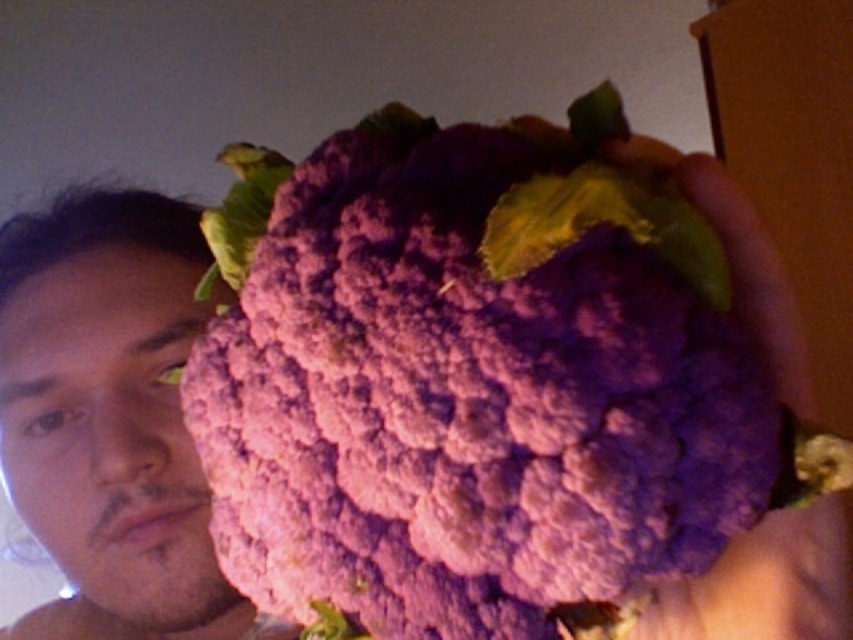
You are taking a photo of the purple matte broccoli at center and the smooth skin face at left. Which object will appear larger in the photo?

The purple matte broccoli at center will appear larger in the photo because it is closer to the viewer than the smooth skin face at left.